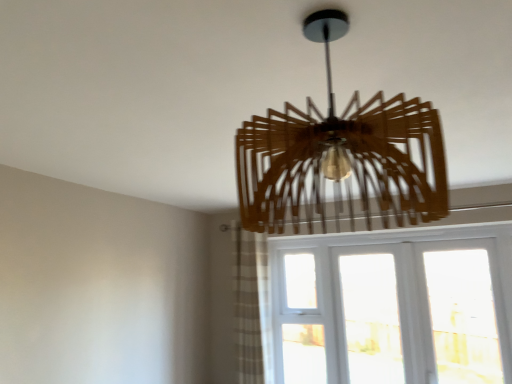
Question: From a real-world perspective, is plaid fabric curtain at lower center on top of white textured glass at lower right?

Choices:
 (A) yes
 (B) no

Answer: (A)

Question: Does plaid fabric curtain at lower center appear on the left side of white textured glass at lower right?

Choices:
 (A) yes
 (B) no

Answer: (A)

Question: Is plaid fabric curtain at lower center completely or partially outside of white textured glass at lower right?

Choices:
 (A) yes
 (B) no

Answer: (A)

Question: Does plaid fabric curtain at lower center have a lesser height compared to white textured glass at lower right?

Choices:
 (A) no
 (B) yes

Answer: (A)

Question: Are plaid fabric curtain at lower center and white textured glass at lower right far apart?

Choices:
 (A) no
 (B) yes

Answer: (A)

Question: Is white textured glass at lower right bigger or smaller than plaid fabric curtain at lower center?

Choices:
 (A) big
 (B) small

Answer: (A)

Question: Is white textured glass at lower right wider or thinner than plaid fabric curtain at lower center?

Choices:
 (A) wide
 (B) thin

Answer: (B)

Question: Considering their positions, is white textured glass at lower right located in front of or behind plaid fabric curtain at lower center?

Choices:
 (A) front
 (B) behind

Answer: (A)

Question: From a real-world perspective, relative to plaid fabric curtain at lower center, is white textured glass at lower right vertically above or below?

Choices:
 (A) above
 (B) below

Answer: (B)

Question: Is point (280, 190) closer or farther from the camera than point (246, 238)?

Choices:
 (A) farther
 (B) closer

Answer: (B)

Question: Is wooden chandelier at center to the left or to the right of plaid fabric curtain at lower center in the image?

Choices:
 (A) right
 (B) left

Answer: (A)

Question: Is wooden chandelier at center inside or outside of plaid fabric curtain at lower center?

Choices:
 (A) outside
 (B) inside

Answer: (A)

Question: Looking at their shapes, would you say wooden chandelier at center is wider or thinner than plaid fabric curtain at lower center?

Choices:
 (A) thin
 (B) wide

Answer: (B)

Question: Looking at their shapes, would you say plaid fabric curtain at lower center is wider or thinner than wooden chandelier at center?

Choices:
 (A) thin
 (B) wide

Answer: (A)

Question: Is plaid fabric curtain at lower center taller or shorter than wooden chandelier at center?

Choices:
 (A) short
 (B) tall

Answer: (B)